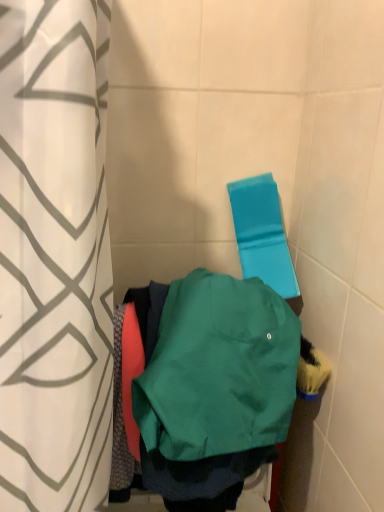
Question: In terms of size, does white fabric curtain at left appear bigger or smaller than green matte sweatshirt at center?

Choices:
 (A) small
 (B) big

Answer: (B)

Question: Visually, is white fabric curtain at left positioned to the left or to the right of green matte sweatshirt at center?

Choices:
 (A) left
 (B) right

Answer: (A)

Question: Based on their relative distances, which object is farther from the green matte sweatshirt at center?

Choices:
 (A) blue fabric beach towel at upper right
 (B) white fabric curtain at left

Answer: (A)

Question: Which object is the closest to the white fabric curtain at left?

Choices:
 (A) blue fabric beach towel at upper right
 (B) green matte sweatshirt at center

Answer: (B)